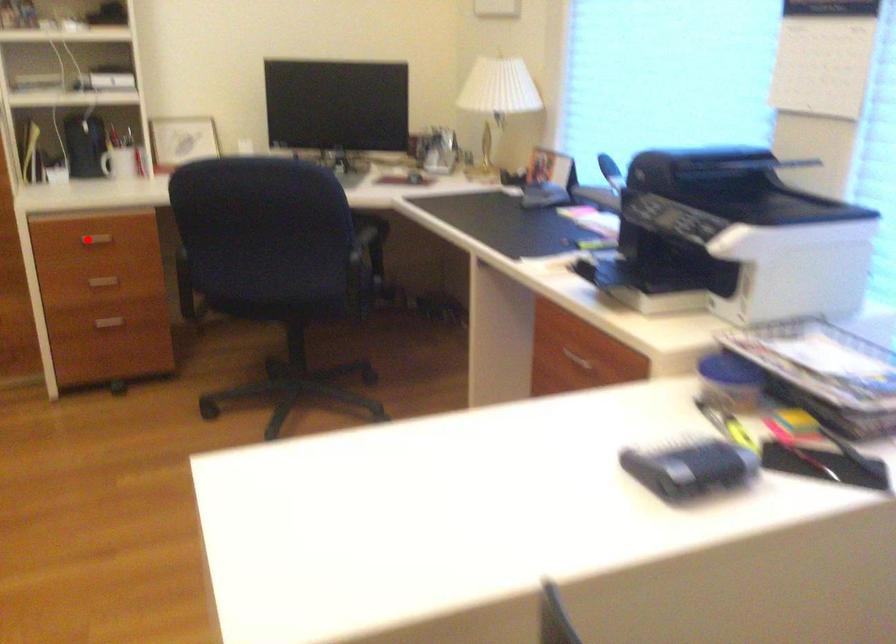
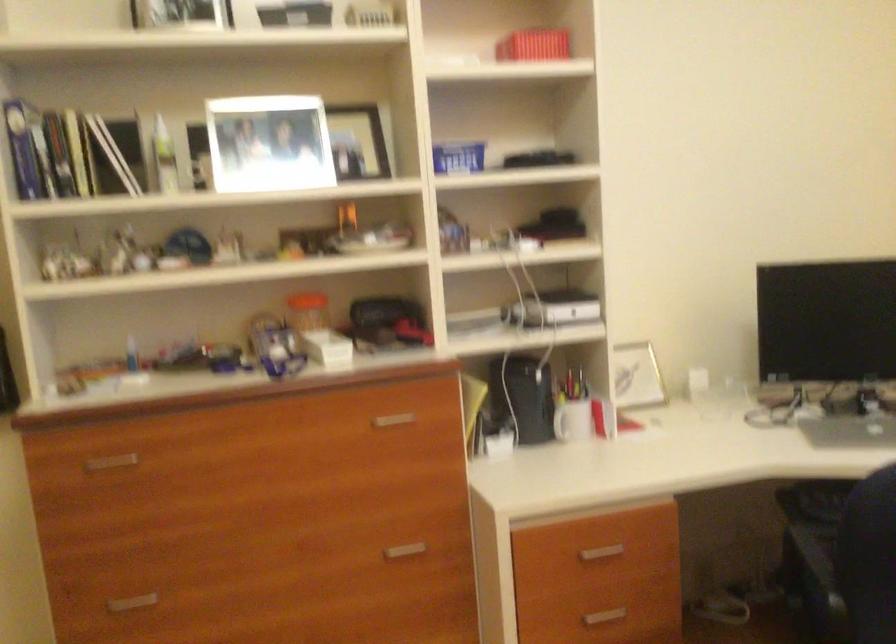
Question: I am providing you with two images of the same scene from different viewpoints. Given a red point in image1, look at the same physical point in image2. Is it:

Choices:
 (A) Closer to the viewpoint
 (B) Farther from the viewpoint

Answer: (A)